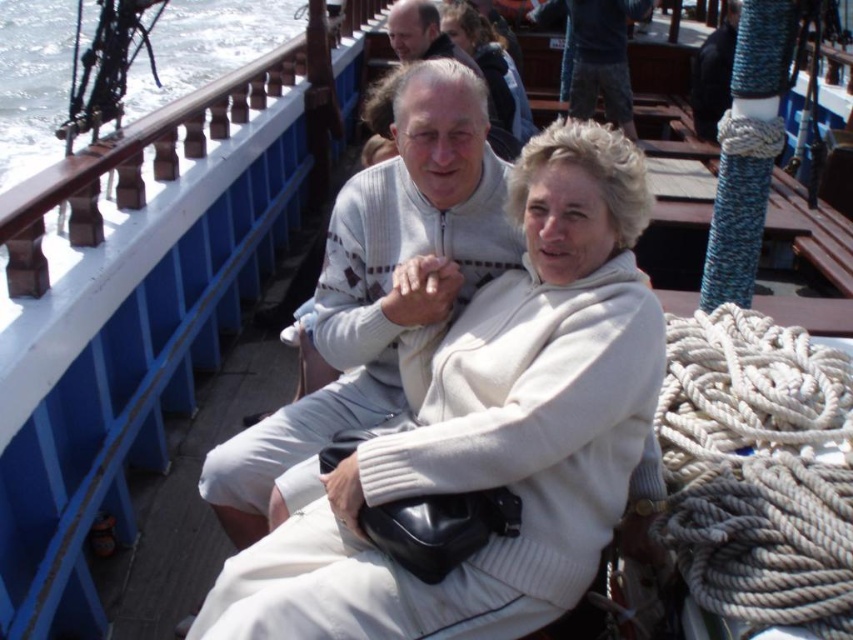
Question: Which of the following is the farthest from the observer?

Choices:
 (A) (424, 32)
 (B) (440, 288)
 (C) (577, 26)
 (D) (469, 24)

Answer: (C)

Question: Does light gray sweater at center have a larger size compared to dark blue jeans at upper center?

Choices:
 (A) no
 (B) yes

Answer: (B)

Question: Which object appears closest to the camera in this image?

Choices:
 (A) smooth brown hair at upper center
 (B) dark blue jeans at upper center
 (C) light gray sweater at center
 (D) white wool sweater at upper center

Answer: (C)

Question: Does white wool sweater at upper center lie behind smooth brown hair at upper center?

Choices:
 (A) yes
 (B) no

Answer: (A)

Question: Is light gray sweater at center below dark blue jeans at upper center?

Choices:
 (A) no
 (B) yes

Answer: (B)

Question: Which point is closer to the camera?

Choices:
 (A) light gray sweater at center
 (B) white wool sweater at upper center
 (C) dark blue jeans at upper center
 (D) smooth brown hair at upper center

Answer: (A)